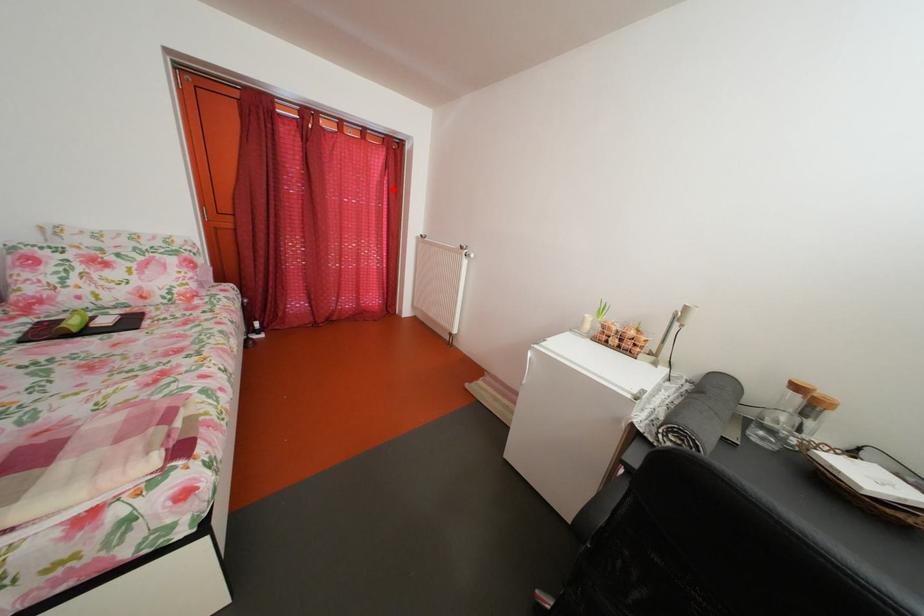
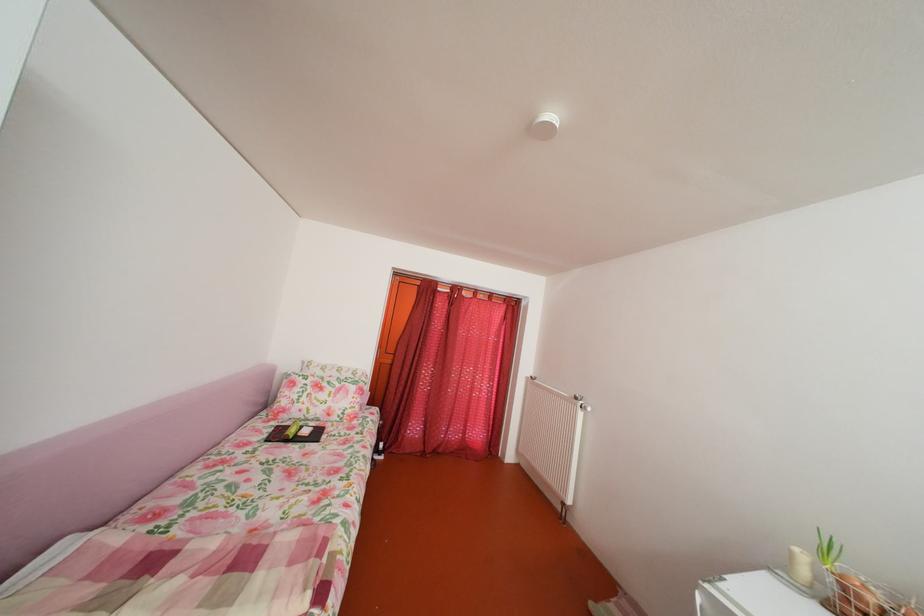
The point at the highlighted location is marked in the first image. Where is the corresponding point in the second image?

(511, 337)